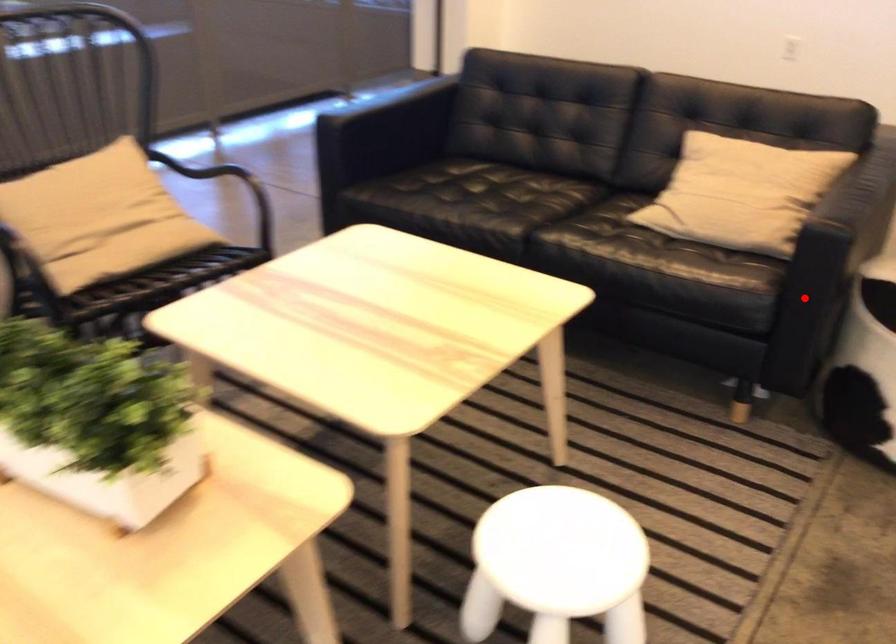
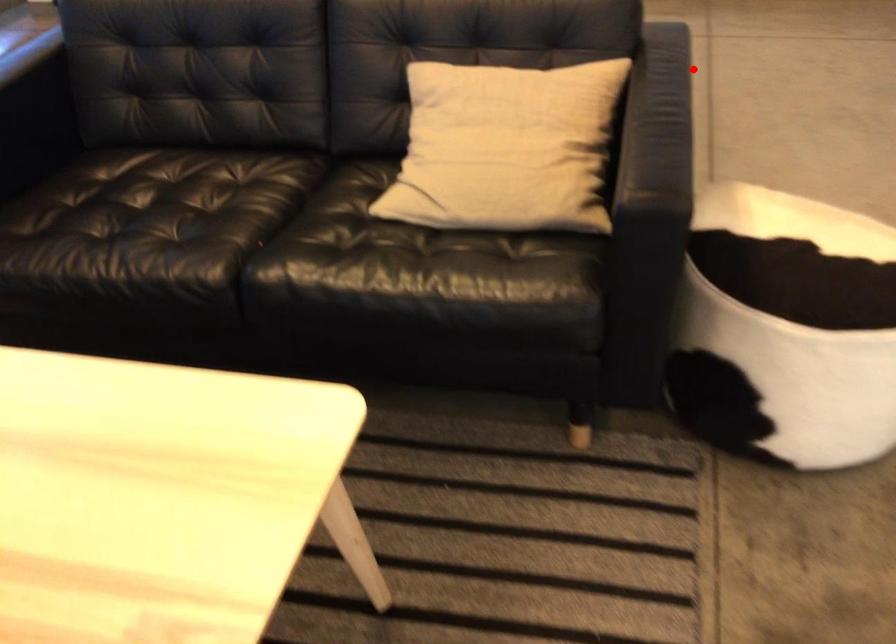
I am providing you with two images of the same scene from different viewpoints. A red point is marked on the first image and another point is marked on the second image. Is the marked point in image1 the same physical position as the marked point in image2?

No